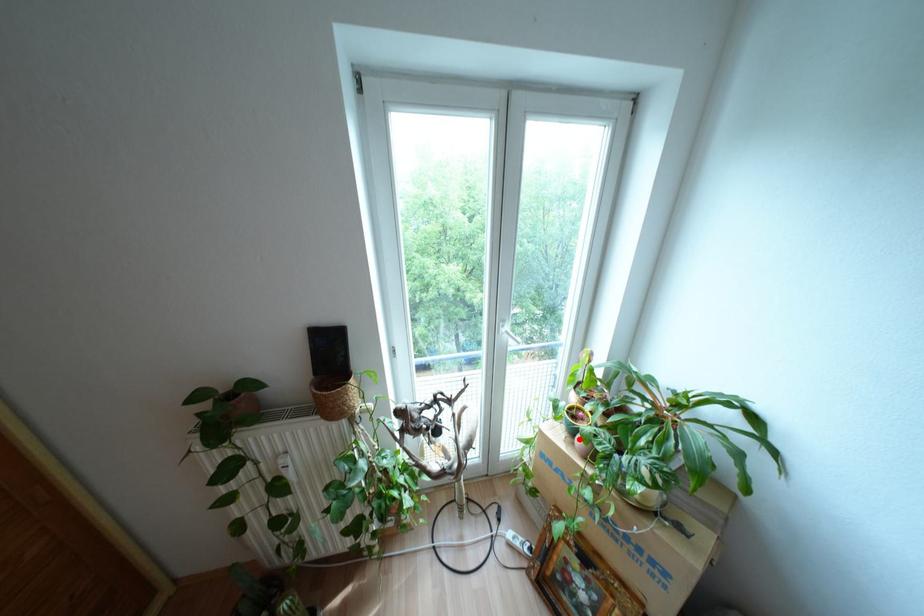
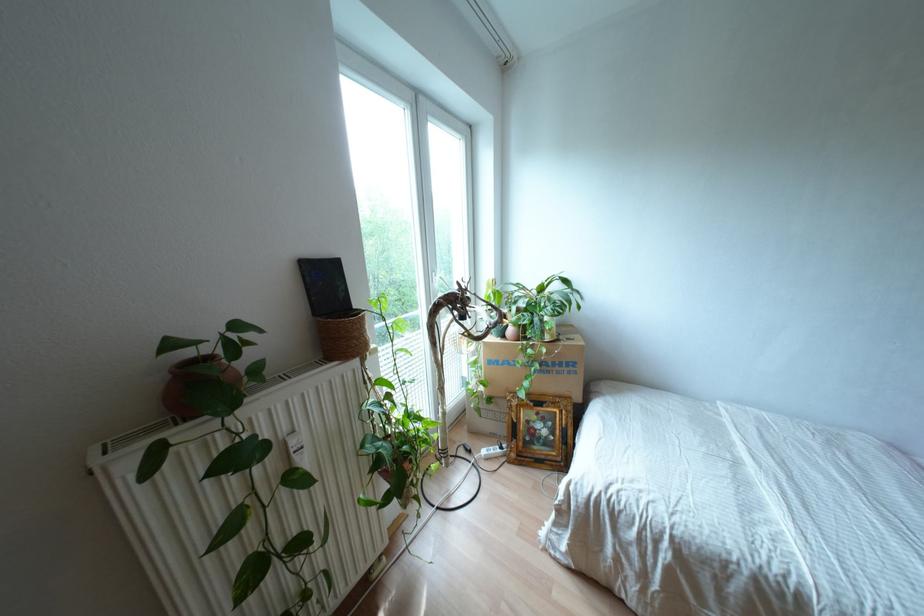
The point at the highlighted location is marked in the first image. Where is the corresponding point in the second image?

(509, 330)